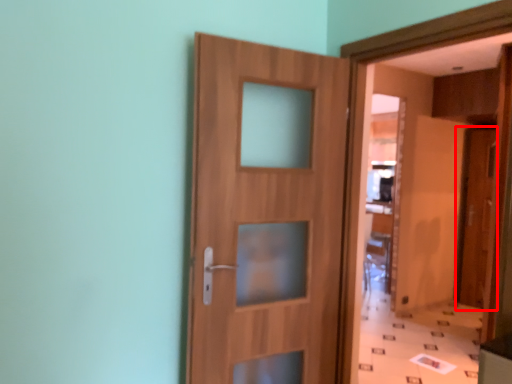
Question: From the image's perspective, what is the correct spatial positioning of door (annotated by the red box) in reference to door?

Choices:
 (A) below
 (B) above

Answer: (A)